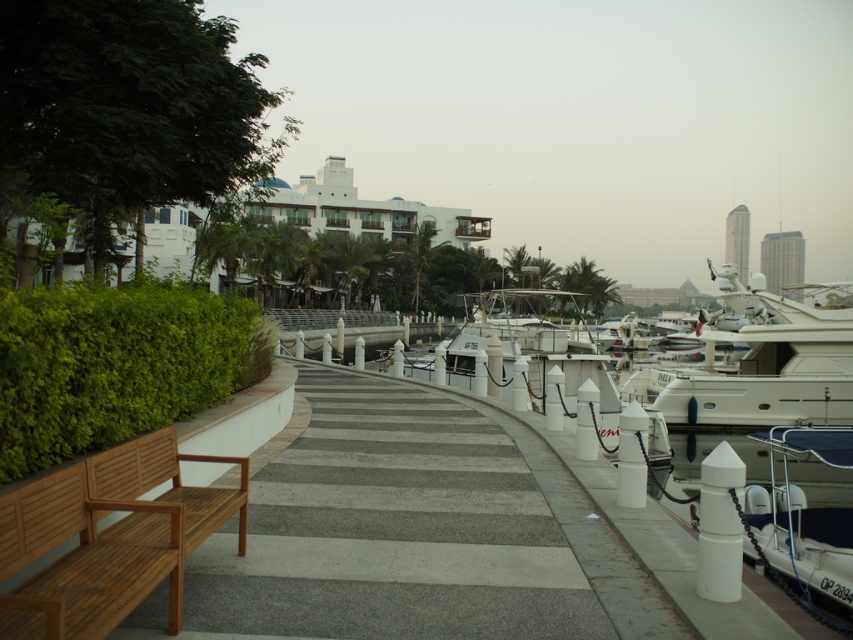
What do you see at coordinates (759, 371) in the screenshot? I see `white glossy boat at right` at bounding box center [759, 371].

Does white glossy boat at right lie behind white glossy boat at center?

No, it is not.

You are a GUI agent. You are given a task and a screenshot of the screen. Output one action in this format:
    pyautogui.click(x=<x>, y=<y>)
    Task: Click on the white glossy boat at right
    
    Given the screenshot: What is the action you would take?
    pyautogui.click(x=759, y=371)

Can you confirm if teak wood bench at lower left is smaller than white glossy boat at lower right?

Correct, teak wood bench at lower left occupies less space than white glossy boat at lower right.

Image resolution: width=853 pixels, height=640 pixels. Find the location of `teak wood bench at lower left`. teak wood bench at lower left is located at coordinates (107, 538).

Identify the location of teak wood bench at lower left. This screenshot has height=640, width=853. (107, 538).

Is teak wood bench at lower left further to camera compared to white glossy boat at center?

No, teak wood bench at lower left is in front of white glossy boat at center.

Who is more forward, [80,604] or [573,300]?

Positioned in front is point [80,604].

This screenshot has height=640, width=853. Describe the element at coordinates (107, 538) in the screenshot. I see `teak wood bench at lower left` at that location.

Where is `teak wood bench at lower left`? The width and height of the screenshot is (853, 640). teak wood bench at lower left is located at coordinates (107, 538).